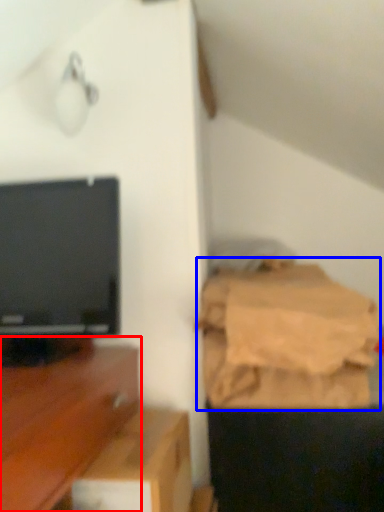
Question: Which object is closer to the camera taking this photo, furniture (highlighted by a red box) or sheet (highlighted by a blue box)?

Choices:
 (A) furniture
 (B) sheet

Answer: (A)